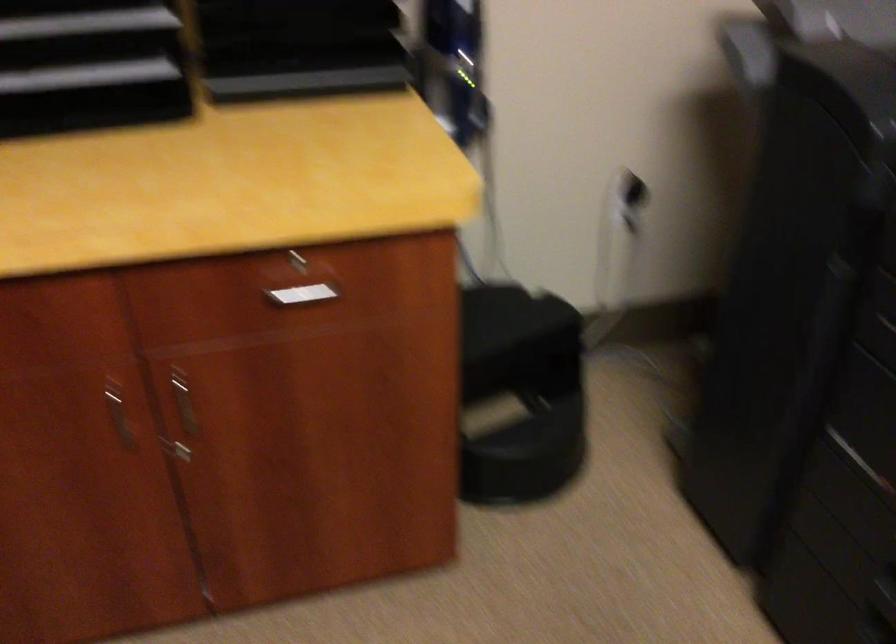
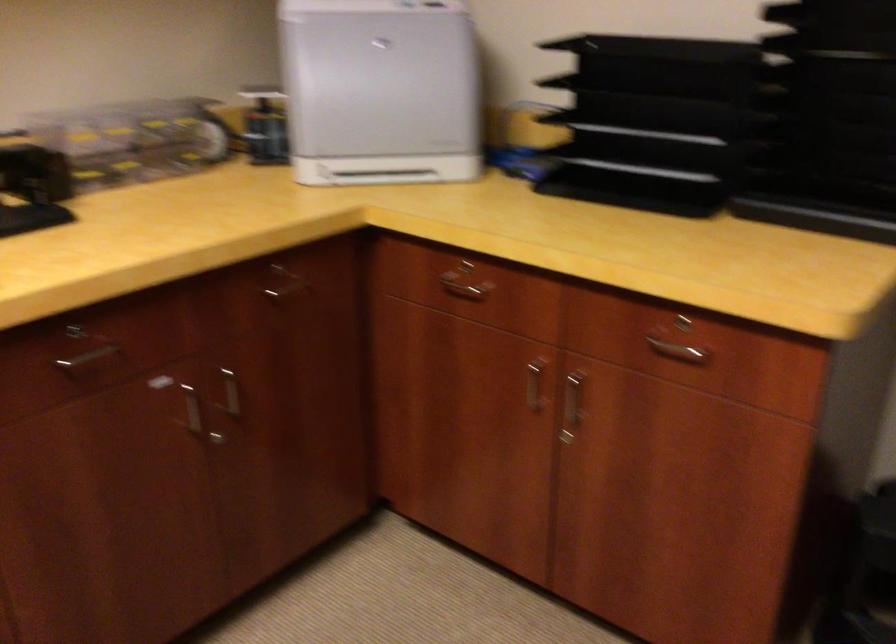
In the second image, find the point that corresponds to the point at 297,256 in the first image.

(686, 321)